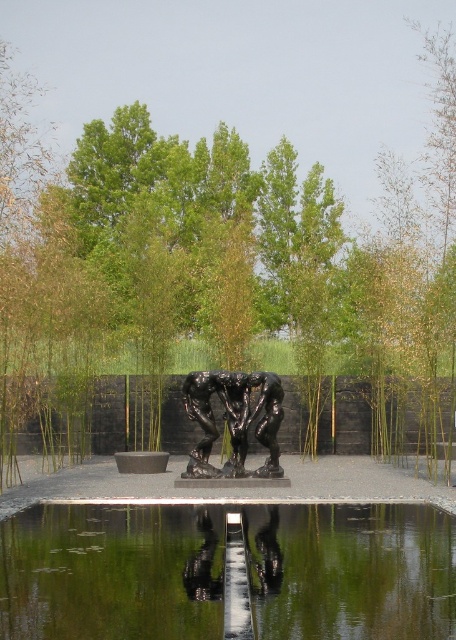
Question: Can you confirm if green leafy tree at center is wider than black polished bronze sculpture at center?

Choices:
 (A) no
 (B) yes

Answer: (B)

Question: Which object appears farthest from the camera in this image?

Choices:
 (A) transparent glass water at center
 (B) black polished bronze sculpture at center
 (C) green leafy tree at center

Answer: (C)

Question: Estimate the real-world distances between objects in this image. Which object is closer to the transparent glass water at center?

Choices:
 (A) black polished bronze sculpture at center
 (B) green leafy tree at center

Answer: (A)

Question: Can you confirm if transparent glass water at center is wider than black polished bronze sculpture at center?

Choices:
 (A) no
 (B) yes

Answer: (A)

Question: Is transparent glass water at center positioned behind black polished bronze sculpture at center?

Choices:
 (A) no
 (B) yes

Answer: (A)

Question: Estimate the real-world distances between objects in this image. Which object is closer to the green leafy tree at center?

Choices:
 (A) transparent glass water at center
 (B) black polished bronze sculpture at center

Answer: (B)